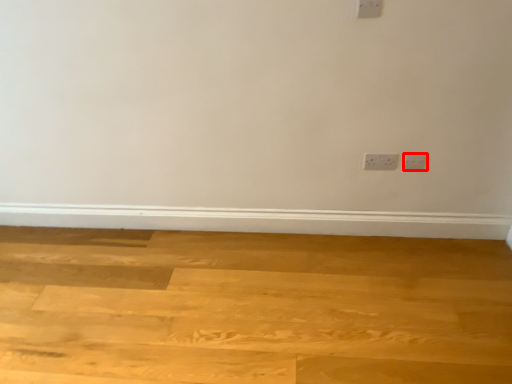
Question: From the image's perspective, what is the correct spatial relationship of power plugs and sockets (annotated by the red box) in relation to plywood?

Choices:
 (A) above
 (B) below

Answer: (A)